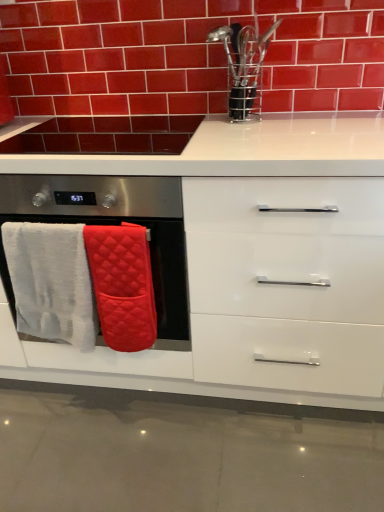
The width and height of the screenshot is (384, 512). What do you see at coordinates (252, 265) in the screenshot? I see `white glossy cabinet at center` at bounding box center [252, 265].

Image resolution: width=384 pixels, height=512 pixels. Find the location of `quilted cotton bath towel at left, acting as the first bath towel starting from the right`. quilted cotton bath towel at left, acting as the first bath towel starting from the right is located at coordinates (122, 285).

What do you see at coordinates (51, 282) in the screenshot? This screenshot has width=384, height=512. I see `white fluffy bath towel at left, the first bath towel when ordered from left to right` at bounding box center [51, 282].

You are a GUI agent. You are given a task and a screenshot of the screen. Output one action in this format:
    pyautogui.click(x=<x>, y=<y>)
    Task: Click on the glossy ceramic brick at upper center
    
    Given the screenshot: What is the action you would take?
    pyautogui.click(x=187, y=55)

Locate an element on the screen. This screenshot has height=512, width=384. white glossy cabinet at center is located at coordinates (252, 265).

How different are the orientations of white quilted oven mitts at left and quilted cotton bath towel at left, which is counted as the 2th bath towel, starting from the left, in degrees?

The angular difference between white quilted oven mitts at left and quilted cotton bath towel at left, which is counted as the 2th bath towel, starting from the left, is 0.194 degrees.

Which is in front, white quilted oven mitts at left or quilted cotton bath towel at left, acting as the first bath towel starting from the right?

white quilted oven mitts at left.

In the scene shown: Can you confirm if white quilted oven mitts at left is smaller than quilted cotton bath towel at left, which is counted as the 2th bath towel, starting from the left?

Actually, white quilted oven mitts at left might be larger than quilted cotton bath towel at left, which is counted as the 2th bath towel, starting from the left.

Which is closer, (179,294) or (99,225)?

The point (99,225) is in front.

Which point is more distant from viewer, [137,241] or [249,339]?

Positioned behind is point [249,339].

Is quilted cotton bath towel at left, which is counted as the 2th bath towel, starting from the left, turned away from white glossy cabinet at center?

Yes, quilted cotton bath towel at left, which is counted as the 2th bath towel, starting from the left,'s orientation is away from white glossy cabinet at center.

How different are the orientations of quilted cotton bath towel at left, acting as the first bath towel starting from the right, and white glossy cabinet at center in degrees?

The facing directions of quilted cotton bath towel at left, acting as the first bath towel starting from the right, and white glossy cabinet at center are 0.194 degrees apart.

From the image's perspective, which one is positioned higher, white fluffy bath towel at left, arranged as the second bath towel when viewed from the right, or glossy ceramic brick at upper center?

glossy ceramic brick at upper center.

Is white fluffy bath towel at left, arranged as the second bath towel when viewed from the right, surrounding glossy ceramic brick at upper center?

Definitely not — glossy ceramic brick at upper center is not inside white fluffy bath towel at left, arranged as the second bath towel when viewed from the right.

From the picture: Is white fluffy bath towel at left, the first bath towel when ordered from left to right, not near glossy ceramic brick at upper center?

white fluffy bath towel at left, the first bath towel when ordered from left to right, is near glossy ceramic brick at upper center, not far away.

Considering the relative sizes of white glossy cabinet at center and white quilted oven mitts at left in the image provided, is white glossy cabinet at center thinner than white quilted oven mitts at left?

No.

From the picture: Is white glossy cabinet at center to the left of white quilted oven mitts at left from the viewer's perspective?

In fact, white glossy cabinet at center is to the right of white quilted oven mitts at left.

Consider the image. Can you tell me how much white glossy cabinet at center and white quilted oven mitts at left differ in facing direction?

7.56e-05 degrees separate the facing orientations of white glossy cabinet at center and white quilted oven mitts at left.

Are white quilted oven mitts at left and white glossy cabinet at center making contact?

No, white quilted oven mitts at left is not beside white glossy cabinet at center.

Is white quilted oven mitts at left further to camera compared to white glossy cabinet at center?

Yes, it is.

Does point (115, 369) appear closer or farther from the camera than point (382, 374)?

Point (115, 369).

From the image's perspective, between white quilted oven mitts at left and white glossy cabinet at center, who is located below?

white glossy cabinet at center appears lower in the image.

Is glossy ceramic brick at upper center further to camera compared to quilted cotton bath towel at left, which is counted as the 2th bath towel, starting from the left?

Yes.

In terms of height, does glossy ceramic brick at upper center look taller or shorter compared to quilted cotton bath towel at left, which is counted as the 2th bath towel, starting from the left?

In the image, glossy ceramic brick at upper center appears to be taller than quilted cotton bath towel at left, which is counted as the 2th bath towel, starting from the left.

How many degrees apart are the facing directions of glossy ceramic brick at upper center and quilted cotton bath towel at left, acting as the first bath towel starting from the right?

There is a 1.05-degree angle between the facing directions of glossy ceramic brick at upper center and quilted cotton bath towel at left, acting as the first bath towel starting from the right.

Considering the sizes of objects glossy ceramic brick at upper center and quilted cotton bath towel at left, which is counted as the 2th bath towel, starting from the left, in the image provided, who is wider, glossy ceramic brick at upper center or quilted cotton bath towel at left, which is counted as the 2th bath towel, starting from the left,?

A: With larger width is quilted cotton bath towel at left, which is counted as the 2th bath towel, starting from the left.

Which is behind, white fluffy bath towel at left, the first bath towel when ordered from left to right, or quilted cotton bath towel at left, acting as the first bath towel starting from the right?

white fluffy bath towel at left, the first bath towel when ordered from left to right, is further from the camera.

Between white fluffy bath towel at left, arranged as the second bath towel when viewed from the right, and quilted cotton bath towel at left, acting as the first bath towel starting from the right, which one has larger size?

Bigger between the two is white fluffy bath towel at left, arranged as the second bath towel when viewed from the right.

From a real-world perspective, is white fluffy bath towel at left, the first bath towel when ordered from left to right, under quilted cotton bath towel at left, acting as the first bath towel starting from the right?

No, from a real-world perspective, white fluffy bath towel at left, the first bath towel when ordered from left to right, is not beneath quilted cotton bath towel at left, acting as the first bath towel starting from the right.

Is quilted cotton bath towel at left, acting as the first bath towel starting from the right, at the back of white fluffy bath towel at left, the first bath towel when ordered from left to right?

white fluffy bath towel at left, the first bath towel when ordered from left to right, is not turned away from quilted cotton bath towel at left, acting as the first bath towel starting from the right.

There is a white quilted oven mitts at left. Where is `the 2nd bath towel below it (from a real-world perspective)`? The image size is (384, 512). the 2nd bath towel below it (from a real-world perspective) is located at coordinates (122, 285).

From the image's perspective, which bath towel is the 2nd one below the white glossy cabinet at center? Please provide its 2D coordinates.

[(122, 285)]

Which object lies further to the anchor point white glossy cabinet at center, white fluffy bath towel at left, arranged as the second bath towel when viewed from the right, or white quilted oven mitts at left?

Based on the image, white fluffy bath towel at left, arranged as the second bath towel when viewed from the right, appears to be further to white glossy cabinet at center.

Estimate the real-world distances between objects in this image. Which object is closer to white quilted oven mitts at left, glossy ceramic brick at upper center or white glossy cabinet at center?

The object closer to white quilted oven mitts at left is white glossy cabinet at center.

When comparing their distances from glossy ceramic brick at upper center, does white quilted oven mitts at left or white fluffy bath towel at left, the first bath towel when ordered from left to right, seem closer?

The object closer to glossy ceramic brick at upper center is white quilted oven mitts at left.

When comparing their distances from white fluffy bath towel at left, the first bath towel when ordered from left to right, does quilted cotton bath towel at left, which is counted as the 2th bath towel, starting from the left, or white glossy cabinet at center seem further?

Among the two, white glossy cabinet at center is located further to white fluffy bath towel at left, the first bath towel when ordered from left to right.

Estimate the real-world distances between objects in this image. Which object is closer to white fluffy bath towel at left, the first bath towel when ordered from left to right, glossy ceramic brick at upper center or quilted cotton bath towel at left, which is counted as the 2th bath towel, starting from the left?

quilted cotton bath towel at left, which is counted as the 2th bath towel, starting from the left, is positioned closer to the anchor white fluffy bath towel at left, the first bath towel when ordered from left to right.

From the image, which object appears to be nearer to white glossy cabinet at center, glossy ceramic brick at upper center or white fluffy bath towel at left, the first bath towel when ordered from left to right?

Among the two, white fluffy bath towel at left, the first bath towel when ordered from left to right, is located nearer to white glossy cabinet at center.

Considering their positions, is white fluffy bath towel at left, the first bath towel when ordered from left to right, positioned closer to quilted cotton bath towel at left, acting as the first bath towel starting from the right, than white quilted oven mitts at left?

white quilted oven mitts at left is closer to quilted cotton bath towel at left, acting as the first bath towel starting from the right.

From the image, which object appears to be farther from white quilted oven mitts at left, white fluffy bath towel at left, the first bath towel when ordered from left to right, or white glossy cabinet at center?

white glossy cabinet at center lies further to white quilted oven mitts at left than the other object.

At what (x,y) coordinates should I click in order to perform the action: click on bath towel between white fluffy bath towel at left, arranged as the second bath towel when viewed from the right, and white glossy cabinet at center, in the horizontal direction. Please return your answer as a coordinate pair (x, y). The image size is (384, 512). Looking at the image, I should click on (122, 285).

Where is `cabinetry between white quilted oven mitts at left and quilted cotton bath towel at left, which is counted as the 2th bath towel, starting from the left, in the vertical direction`? cabinetry between white quilted oven mitts at left and quilted cotton bath towel at left, which is counted as the 2th bath towel, starting from the left, in the vertical direction is located at coordinates (252, 265).

Where is `oven between glossy ceramic brick at upper center and white fluffy bath towel at left, arranged as the second bath towel when viewed from the right, from top to bottom`? Image resolution: width=384 pixels, height=512 pixels. oven between glossy ceramic brick at upper center and white fluffy bath towel at left, arranged as the second bath towel when viewed from the right, from top to bottom is located at coordinates (151, 261).

Image resolution: width=384 pixels, height=512 pixels. In order to click on cabinetry between glossy ceramic brick at upper center and quilted cotton bath towel at left, which is counted as the 2th bath towel, starting from the left, from top to bottom in this screenshot , I will do `click(252, 265)`.